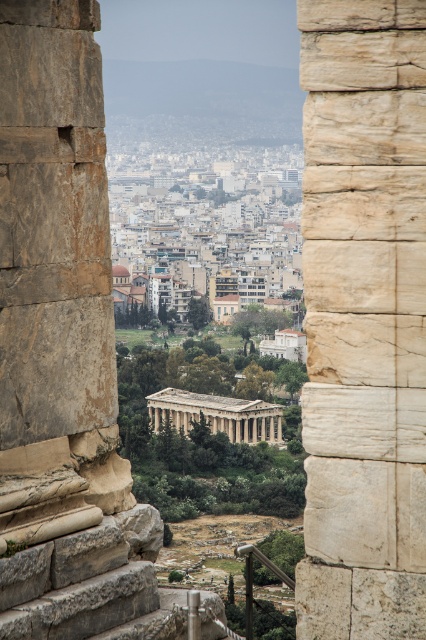
You are an archaeologist examining the ancient site. You notice the white stone column at center and the beige stone temple at center. Based on their positions, which structure is closer to you?

The white stone column at center is closer to you because it is positioned in front of the beige stone temple at center.

You are an architect analyzing the ruins of an ancient temple. You observe the white stone column at center and the beige stone temple at center. Which of these two structures has a greater width?

The beige stone temple at center has a greater width than the white stone column at center.